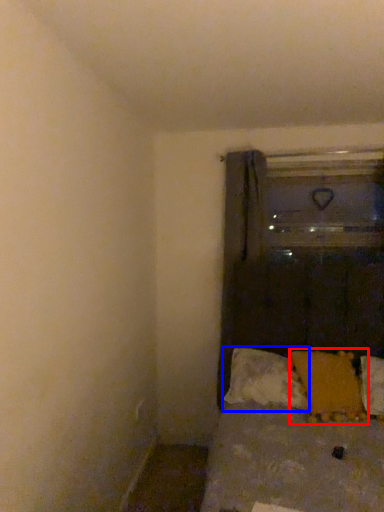
Question: Among these objects, which one is nearest to the camera, pillow (highlighted by a red box) or pillow (highlighted by a blue box)?

Choices:
 (A) pillow
 (B) pillow

Answer: (A)